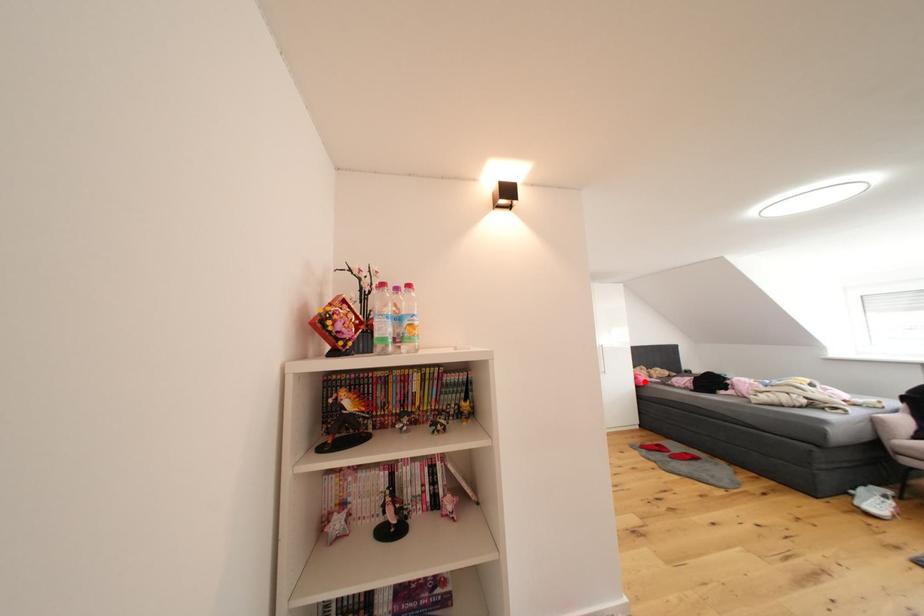
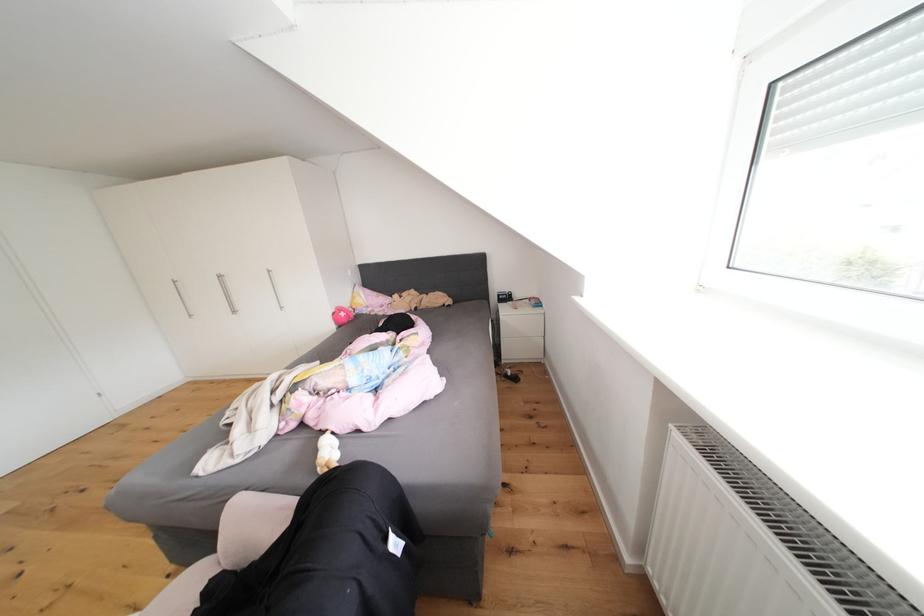
Question: I am providing you with two images of the same scene from different viewpoints. In image1, a red point is highlighted. Considering the same 3D point in image2, which of the following is correct?

Choices:
 (A) It is closer
 (B) It is farther

Answer: (A)